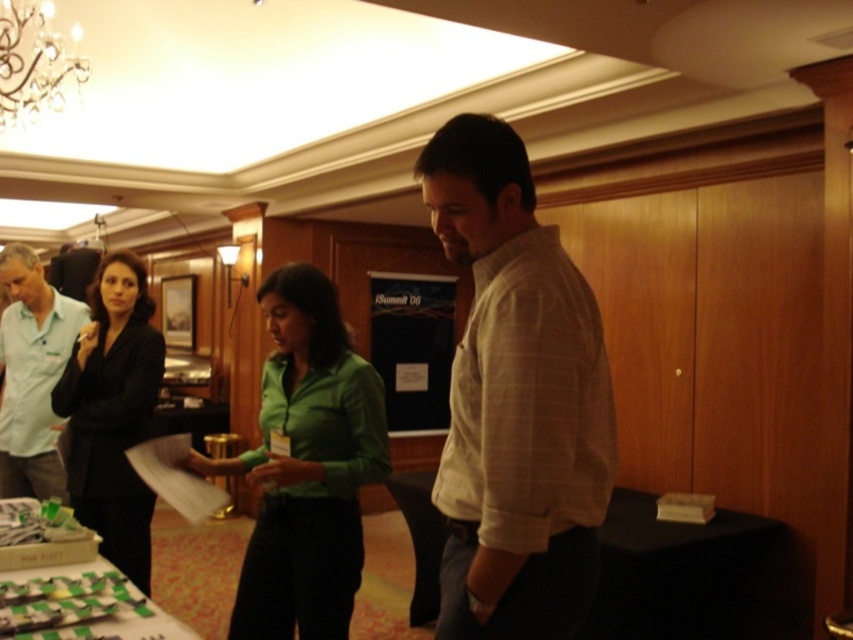
Question: Among these points, which one is nearest to the camera?

Choices:
 (A) (314, 508)
 (B) (527, 316)
 (C) (3, 52)
 (D) (181, 628)

Answer: (B)

Question: Does green matte shirt at center appear on the left side of black matte blazer at left?

Choices:
 (A) no
 (B) yes

Answer: (A)

Question: Can you confirm if light brown plaid shirt at center is positioned below green matte shirt at center?

Choices:
 (A) yes
 (B) no

Answer: (B)

Question: Which object is the closest to the green matte shirt at center?

Choices:
 (A) black matte blazer at left
 (B) light brown plaid shirt at center
 (C) green striped fabric at lower left

Answer: (C)

Question: Considering the relative positions of black matte blazer at left and green striped fabric at lower left in the image provided, where is black matte blazer at left located with respect to green striped fabric at lower left?

Choices:
 (A) left
 (B) right

Answer: (A)

Question: Considering the real-world distances, which object is farthest from the light brown plaid shirt at center?

Choices:
 (A) green striped fabric at lower left
 (B) crystal glass chandelier at upper left
 (C) matte light blue shirt at left

Answer: (C)